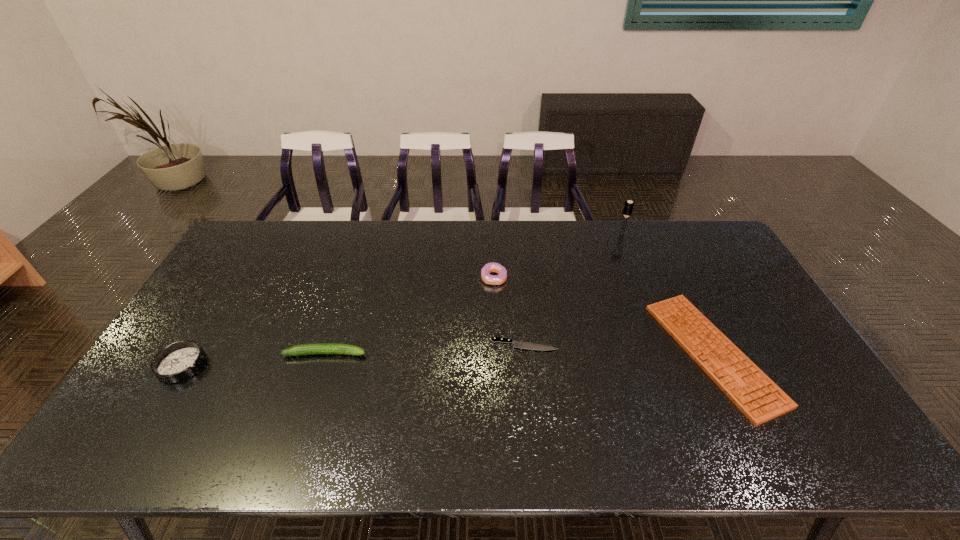
Where is `blank region between the zucchini and the computer keyboard`? The height and width of the screenshot is (540, 960). blank region between the zucchini and the computer keyboard is located at coordinates (519, 353).

This screenshot has width=960, height=540. In order to click on free space between the fifth nearest object and the steak knife in this screenshot , I will do `click(509, 312)`.

In order to click on free spot between the computer keyboard and the doughnut in this screenshot , I will do `click(604, 316)`.

Locate which object is the third closest to the ashtray. Please provide its 2D coordinates. Your answer should be formatted as a tuple, i.e. [(x, y)], where the tuple contains the x and y coordinates of a point satisfying the conditions above.

[(487, 278)]

This screenshot has height=540, width=960. Identify the location of the fourth closest object to the doughnut. (628, 207).

In order to click on vacant region that satisfies the following two spatial constraints: 1. on the back side of the second farthest object; 2. on the left side of the farthest object in this screenshot , I will do `click(492, 233)`.

Locate an element on the screen. This screenshot has width=960, height=540. free spot that satisfies the following two spatial constraints: 1. on the front-facing side of the computer keyboard; 2. on the left side of the zucchini is located at coordinates click(x=325, y=353).

In order to click on free space that satisfies the following two spatial constraints: 1. on the front-facing side of the computer keyboard; 2. on the left side of the fifth object from right to left in this screenshot , I will do `click(325, 353)`.

Identify the location of vacant space that satisfies the following two spatial constraints: 1. on the front-facing side of the zucchini; 2. on the right side of the fifth tallest object. (325, 353).